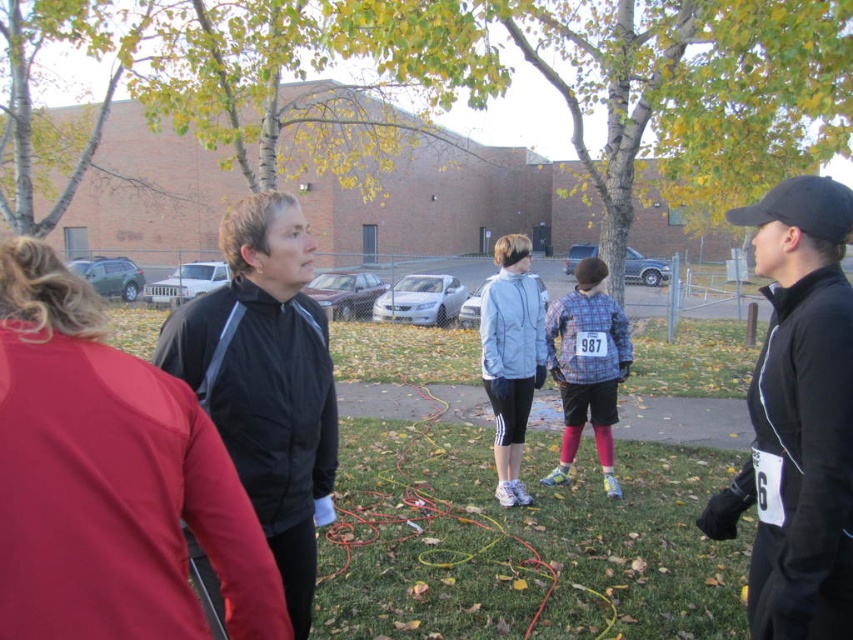
Question: Does matte black jacket at center have a greater width compared to light blue fabric jacket at center?

Choices:
 (A) no
 (B) yes

Answer: (A)

Question: Which point appears farthest from the camera in this image?

Choices:
 (A) (611, 480)
 (B) (511, 388)
 (C) (257, 493)
 (D) (171, 378)

Answer: (A)

Question: Does plaid fabric shirt at center appear on the left side of light blue fabric jacket at center?

Choices:
 (A) yes
 (B) no

Answer: (B)

Question: Estimate the real-world distances between objects in this image. Which object is farther from the black matte jacket at left?

Choices:
 (A) plaid fabric shirt at center
 (B) matte black jacket at center

Answer: (A)

Question: Does matte black jacket at center appear over light blue fabric jacket at center?

Choices:
 (A) yes
 (B) no

Answer: (B)

Question: Estimate the real-world distances between objects in this image. Which object is farther from the black matte jacket at left?

Choices:
 (A) matte black jacket at center
 (B) light blue fabric jacket at center
 (C) plaid fabric shirt at center

Answer: (C)